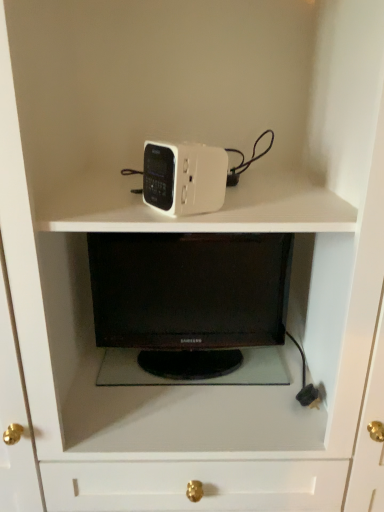
Question: From the image's perspective, would you say white plastic clock at upper center is positioned over black glossy desktop at center?

Choices:
 (A) no
 (B) yes

Answer: (B)

Question: Is white plastic clock at upper center closer to camera compared to black glossy desktop at center?

Choices:
 (A) yes
 (B) no

Answer: (A)

Question: Can you confirm if white plastic clock at upper center is taller than black glossy desktop at center?

Choices:
 (A) yes
 (B) no

Answer: (B)

Question: Are white plastic clock at upper center and black glossy desktop at center far apart?

Choices:
 (A) yes
 (B) no

Answer: (B)

Question: Is white plastic clock at upper center located outside black glossy desktop at center?

Choices:
 (A) no
 (B) yes

Answer: (B)

Question: Is white plastic clock at upper center in contact with black glossy desktop at center?

Choices:
 (A) yes
 (B) no

Answer: (B)

Question: Is black glossy desktop at center at the right side of white plastic clock at upper center?

Choices:
 (A) yes
 (B) no

Answer: (A)

Question: From the image's perspective, is black glossy desktop at center located above white plastic clock at upper center?

Choices:
 (A) yes
 (B) no

Answer: (B)

Question: Is black glossy desktop at center facing towards white plastic clock at upper center?

Choices:
 (A) no
 (B) yes

Answer: (A)

Question: Does black glossy desktop at center lie behind white plastic clock at upper center?

Choices:
 (A) no
 (B) yes

Answer: (B)

Question: Is black glossy desktop at center with white plastic clock at upper center?

Choices:
 (A) yes
 (B) no

Answer: (B)

Question: Considering the relative positions of black glossy desktop at center and white plastic clock at upper center in the image provided, is black glossy desktop at center to the left of white plastic clock at upper center from the viewer's perspective?

Choices:
 (A) yes
 (B) no

Answer: (B)

Question: From their relative heights in the image, would you say white plastic clock at upper center is taller or shorter than black glossy desktop at center?

Choices:
 (A) tall
 (B) short

Answer: (B)